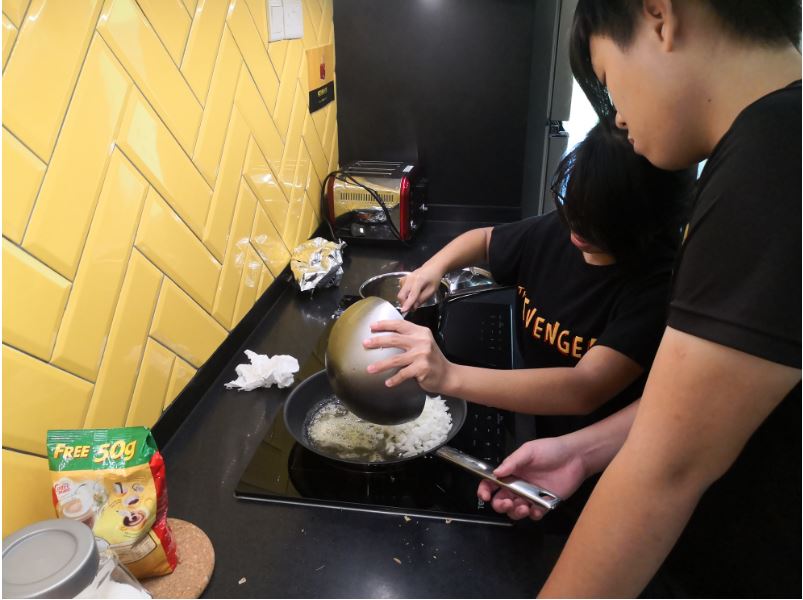
The image size is (803, 600). I want to click on tile wall, so click(x=168, y=181).